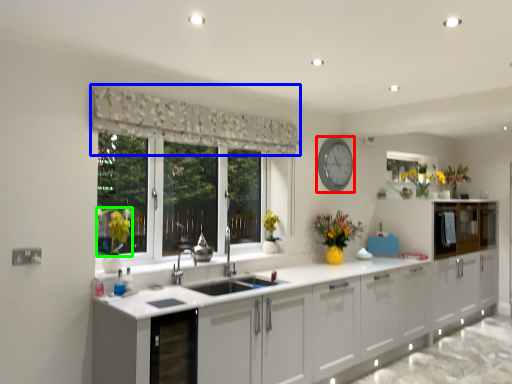
Question: Which is nearer to the clock (highlighted by a red box)? curtain (highlighted by a blue box) or plant (highlighted by a green box).

Choices:
 (A) curtain
 (B) plant

Answer: (A)